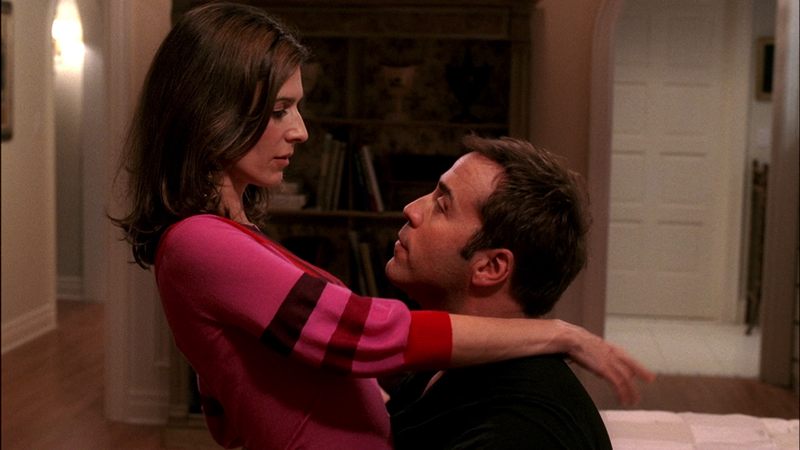
Where is `bed`? The width and height of the screenshot is (800, 450). bed is located at coordinates point(712,424).